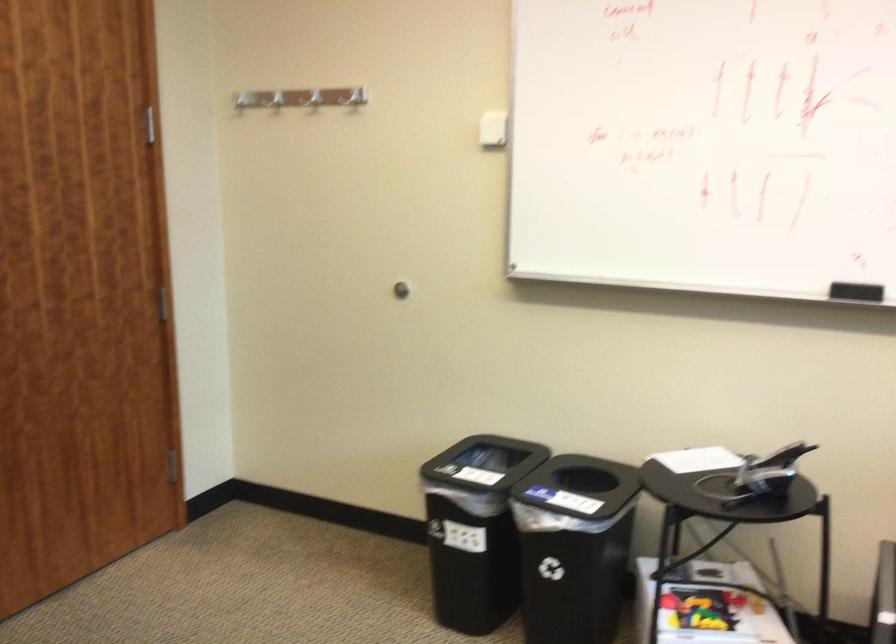
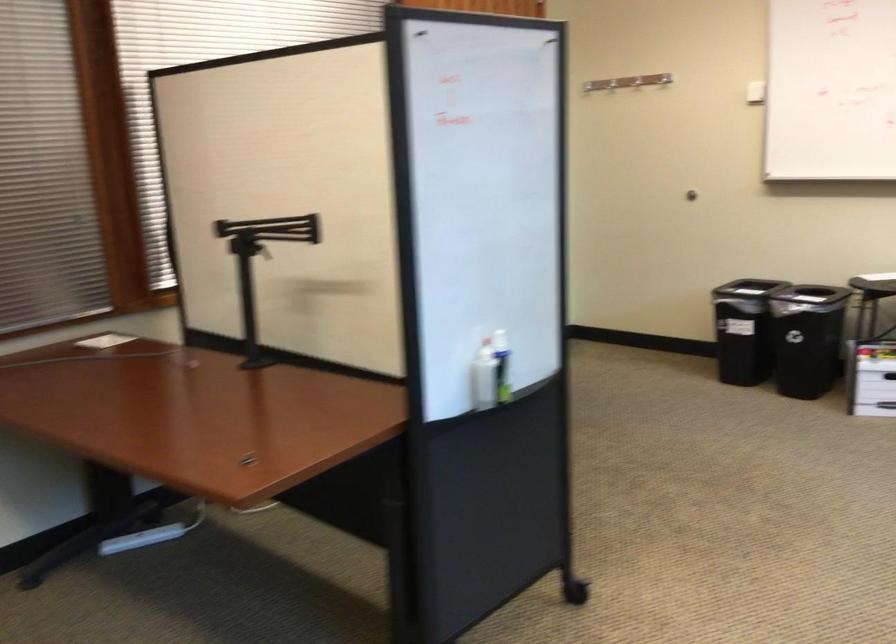
Question: I am providing you with two images of the same scene from different viewpoints. Please identify which objects are invisible in image2.

Choices:
 (A) chair sitting surface
 (B) white spray bottle
 (C) wooden crate
 (D) silver coat hook

Answer: (D)